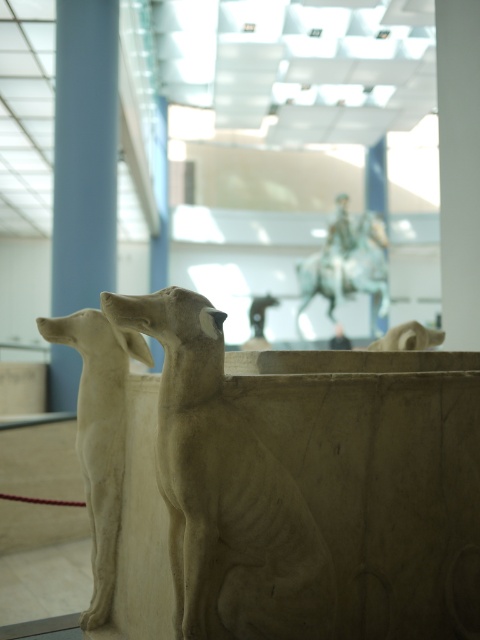
You are an art student visiting the museum and want to sketch the beige stone dog at center and the blue stone pillar at left. From your current position, which object is positioned lower in the image?

The beige stone dog at center is positioned below the blue stone pillar at left, so it is lower in the image.

You are an art student examining the scene. You notice the blue stone pillar at left and the white stone dog at center. Which object is placed higher in the image?

The blue stone pillar at left is positioned over the white stone dog at center, meaning it is higher up in the image.